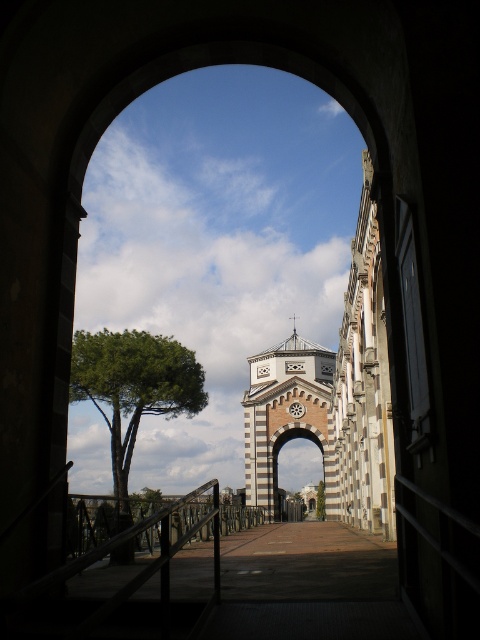
You are standing in front of the arched opening and want to know which tree is wider. Which one is wider between the green leafy tree at left and the green leafy tree at center?

The green leafy tree at left is wider than the green leafy tree at center.

You are standing in front of the matte brick archway at center and want to take a photo of the distant church. If your camera has a maximum zoom range of 100 meters, will you be able to capture the entire church in the photo without moving closer?

The distance between the matte brick archway at center and the camera is 133.05 meters. Since the camera can only zoom up to 100 meters, you won not be able to capture the entire church without moving closer.

You are standing in a garden and see the green leafy tree at left and the matte brick archway at center. Which object is higher up in the scene?

The green leafy tree at left is located above the matte brick archway at center, so it is higher up in the scene.